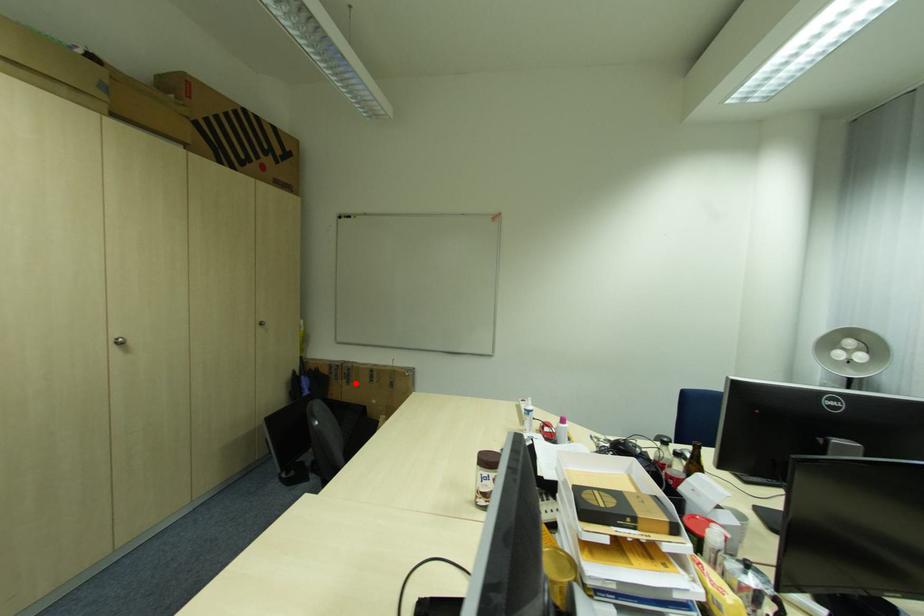
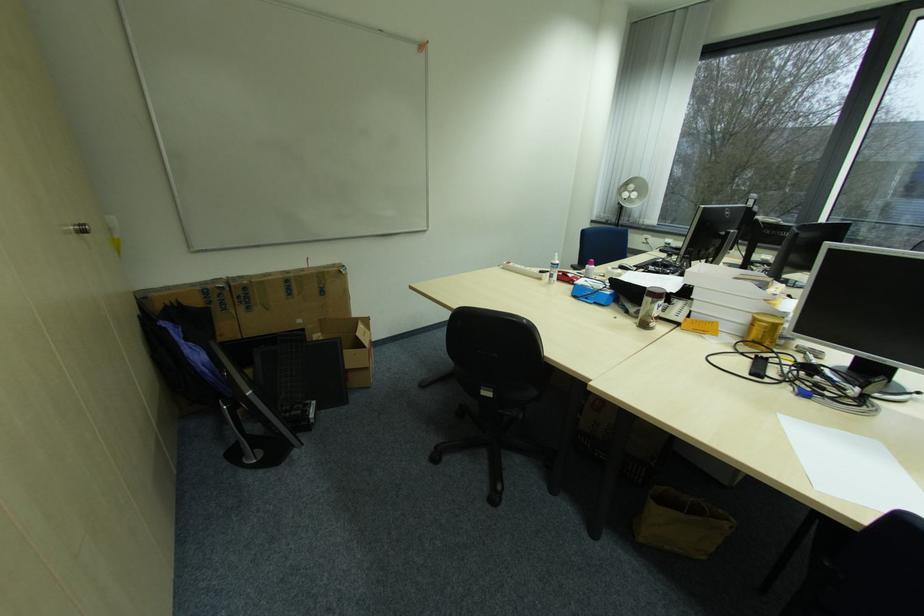
Question: I am providing you with two images of the same scene from different viewpoints. A red point is shown in image1. For the corresponding object point in image2, is it positioned nearer or farther from the camera?

Choices:
 (A) Nearer
 (B) Farther

Answer: (A)